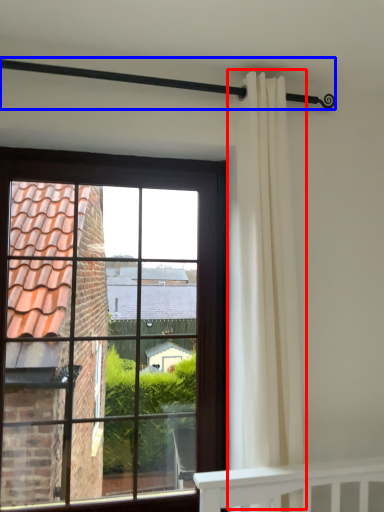
Question: Among these objects, which one is nearest to the camera, curtain (highlighted by a red box) or balustrade (highlighted by a blue box)?

Choices:
 (A) curtain
 (B) balustrade

Answer: (B)